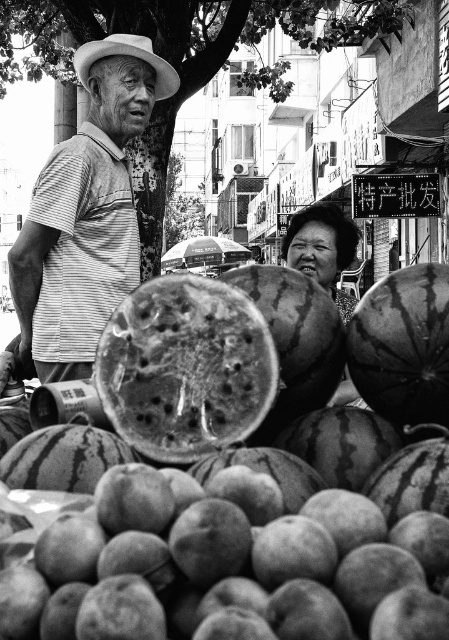
Who is lower down, striped cotton shirt at left or ripe green watermelon at center?

ripe green watermelon at center

Find the location of a particular element. Image resolution: width=449 pixels, height=640 pixels. striped cotton shirt at left is located at coordinates point(86,212).

Who is positioned more to the right, ripe green watermelon at center or smooth dark green watermelon at center?

Positioned to the right is smooth dark green watermelon at center.

How distant is ripe green watermelon at center from smooth dark green watermelon at center?

ripe green watermelon at center is 1.78 meters away from smooth dark green watermelon at center.

Who is more distant from viewer, (431, 364) or (330, 205)?

Positioned behind is point (330, 205).

You are a GUI agent. You are given a task and a screenshot of the screen. Output one action in this format:
    pyautogui.click(x=<x>, y=<y>)
    Task: Click on the ripe green watermelon at center
    The width and height of the screenshot is (449, 640).
    Given the screenshot: What is the action you would take?
    tap(403, 346)

Who is more forward, (120,556) or (294,252)?

Point (120,556)

Is smooth brown peaches at lower center thinner than smooth dark green watermelon at center?

In fact, smooth brown peaches at lower center might be wider than smooth dark green watermelon at center.

Who is more distant from viewer, [64,536] or [293,225]?

Positioned behind is point [293,225].

The image size is (449, 640). Identify the location of smooth brown peaches at lower center. tap(228, 570).